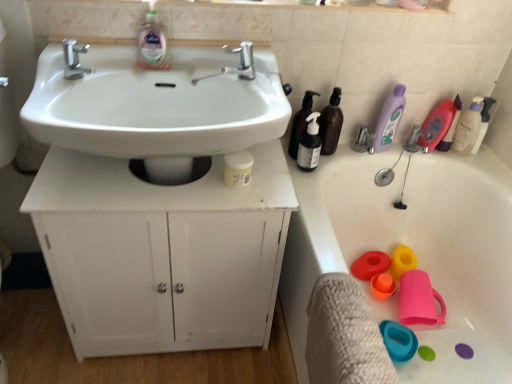
This screenshot has height=384, width=512. What are the coordinates of `free location in front of translucent plastic spray bottle at upper right, which is counted as the second cleaning product, starting from the right` in the screenshot? It's located at [x=463, y=167].